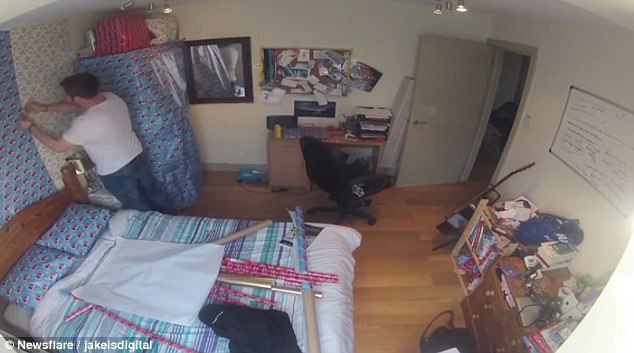
In order to click on white walls in this screenshot , I will do `click(576, 66)`, `click(385, 47)`.